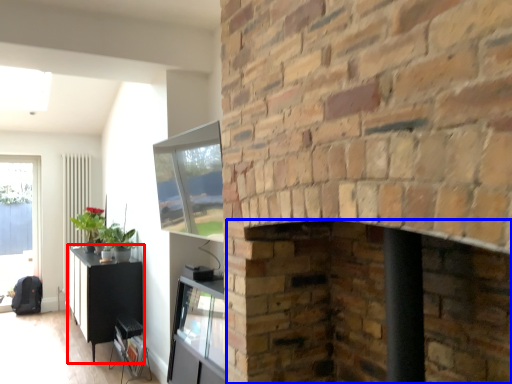
Question: Which of the following is the farthest to the observer, table (highlighted by a red box) or fireplace (highlighted by a blue box)?

Choices:
 (A) table
 (B) fireplace

Answer: (A)